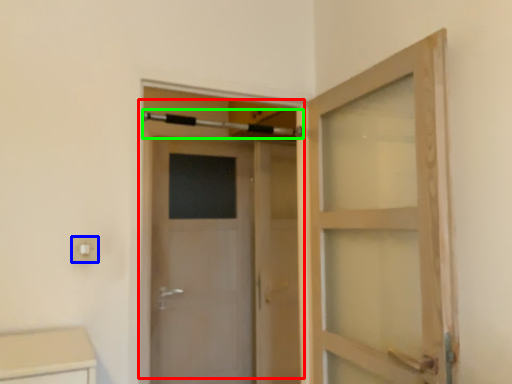
Question: Which object is positioned farthest from door (highlighted by a red box)? Select from electric outlet (highlighted by a blue box) and towel bar (highlighted by a green box).

Choices:
 (A) electric outlet
 (B) towel bar

Answer: (A)